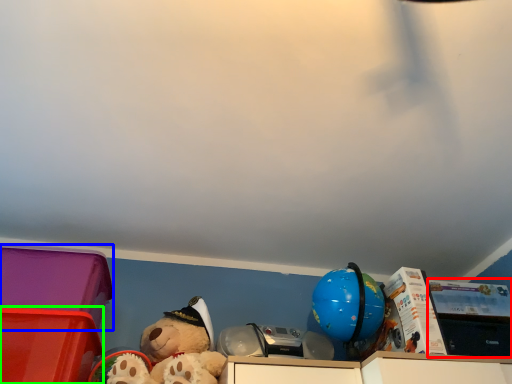
Question: Based on their relative distances, which object is farther from storage box (highlighted by a red box)? Choose from storage box (highlighted by a blue box) and storage box (highlighted by a green box).

Choices:
 (A) storage box
 (B) storage box

Answer: (B)